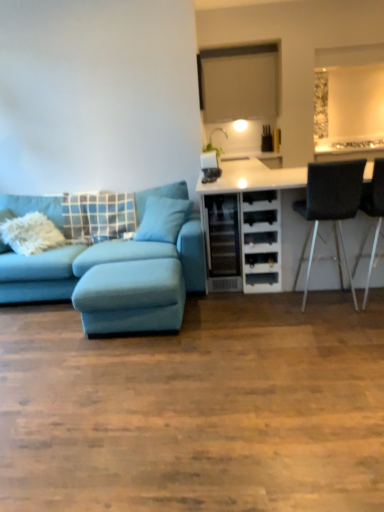
Question: Is white matte cabinet at right to the left or to the right of teal fabric pillow at center, which is the 2th pillow in left-to-right order, in the image?

Choices:
 (A) right
 (B) left

Answer: (A)

Question: Considering the positions of white matte cabinet at right and teal fabric pillow at center, the 1th pillow when ordered from right to left, in the image, is white matte cabinet at right taller or shorter than teal fabric pillow at center, the 1th pillow when ordered from right to left,?

Choices:
 (A) tall
 (B) short

Answer: (A)

Question: Estimate the real-world distances between objects in this image. Which object is farther from the white matte cabinet at right?

Choices:
 (A) metallic silver chair at right, the first chair positioned from the right
 (B) teal fabric pillow at center, which is the 2th pillow in left-to-right order
 (C) blue fabric pillow at left, acting as the first pillow starting from the left
 (D) velvet teal couch at left
 (E) light blue fabric footrest at lower left

Answer: (C)

Question: Which object is the farthest from the metallic silver chair at right, the first chair positioned from the right?

Choices:
 (A) white matte cabinet at right
 (B) blue fabric pillow at left, which is the second pillow from right to left
 (C) velvet teal couch at left
 (D) light blue fabric footrest at lower left
 (E) teal fabric pillow at center, the 1th pillow when ordered from right to left

Answer: (B)